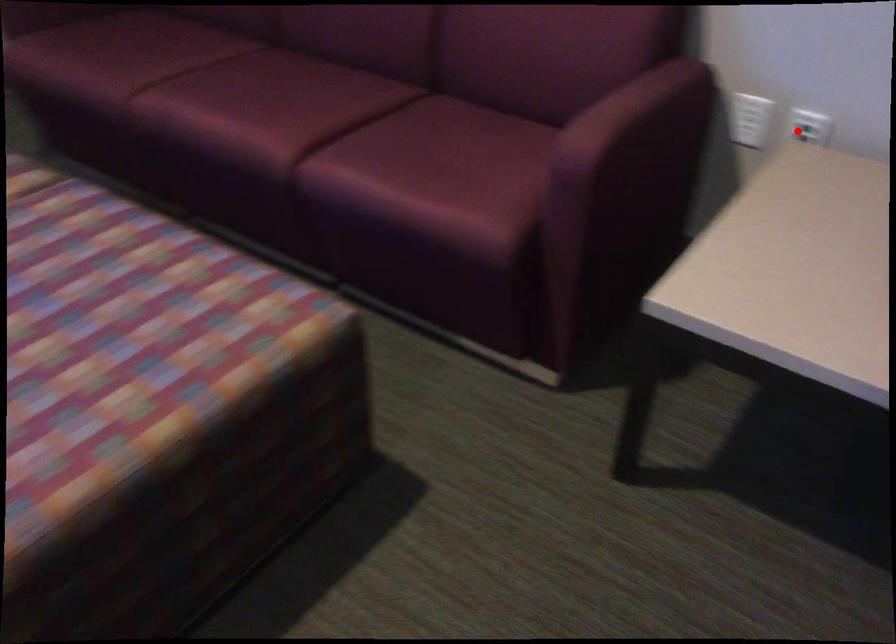
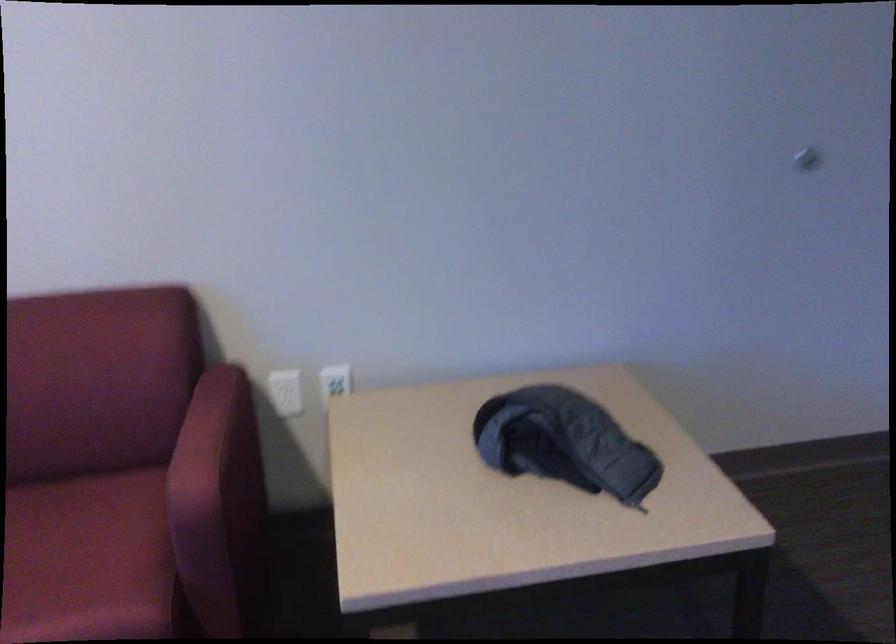
Question: A red point is marked in image1. In image2, is the corresponding 3D point closer to the camera or farther? Reply with the corresponding letter.

Choices:
 (A) The corresponding 3D point is closer.
 (B) The corresponding 3D point is farther.

Answer: (B)